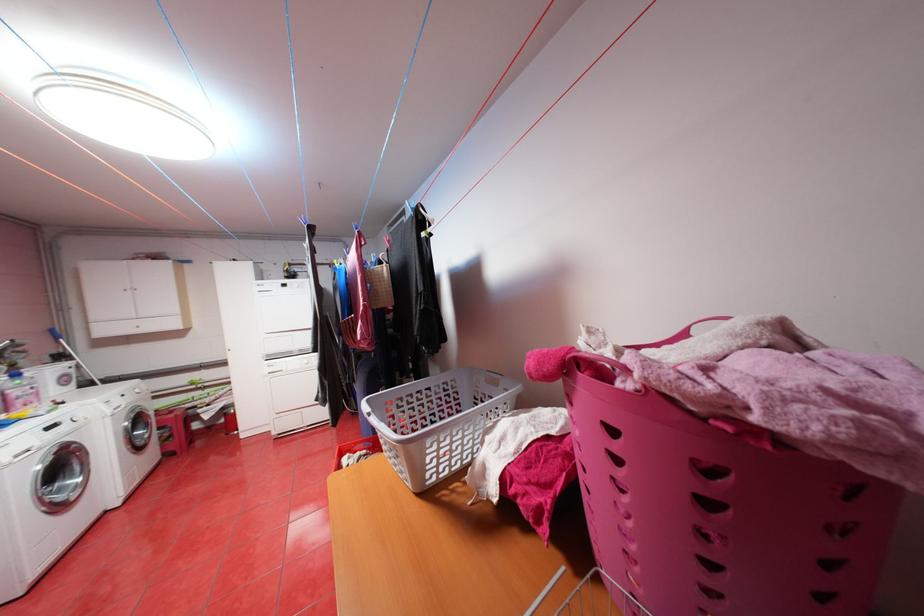
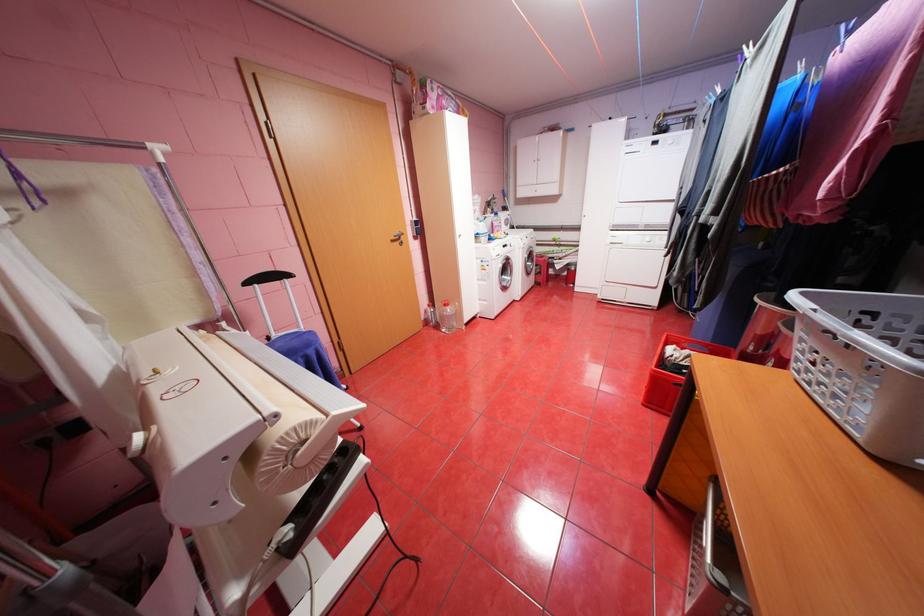
Locate, in the second image, the point that corresponds to point 363,452 in the first image.

(691, 349)